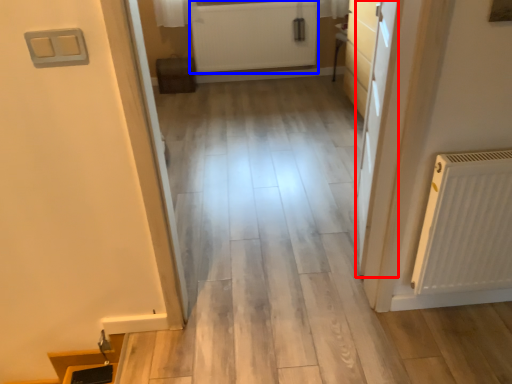
Question: Which object is further to the camera taking this photo, door (highlighted by a red box) or radiator (highlighted by a blue box)?

Choices:
 (A) door
 (B) radiator

Answer: (B)